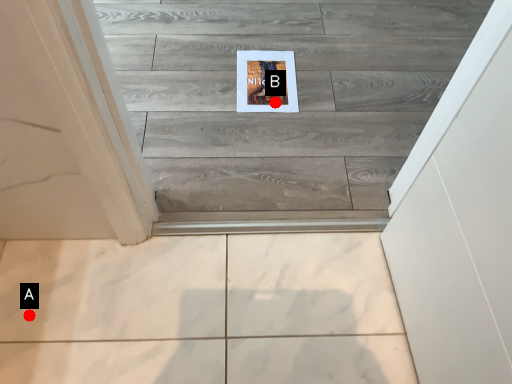
Question: Two points are circled on the image, labeled by A and B beside each circle. Which of the following is the closest to the observer?

Choices:
 (A) A is closer
 (B) B is closer

Answer: (A)